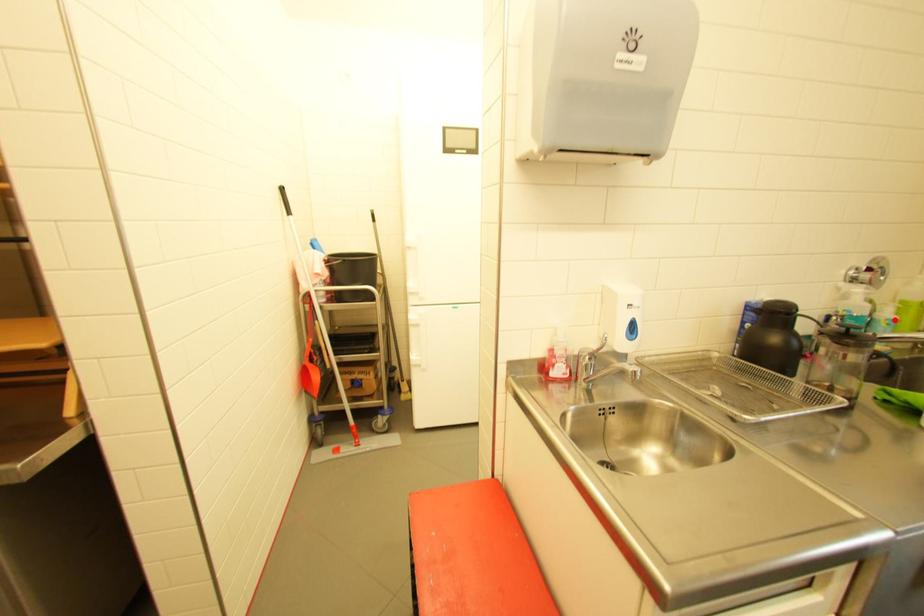
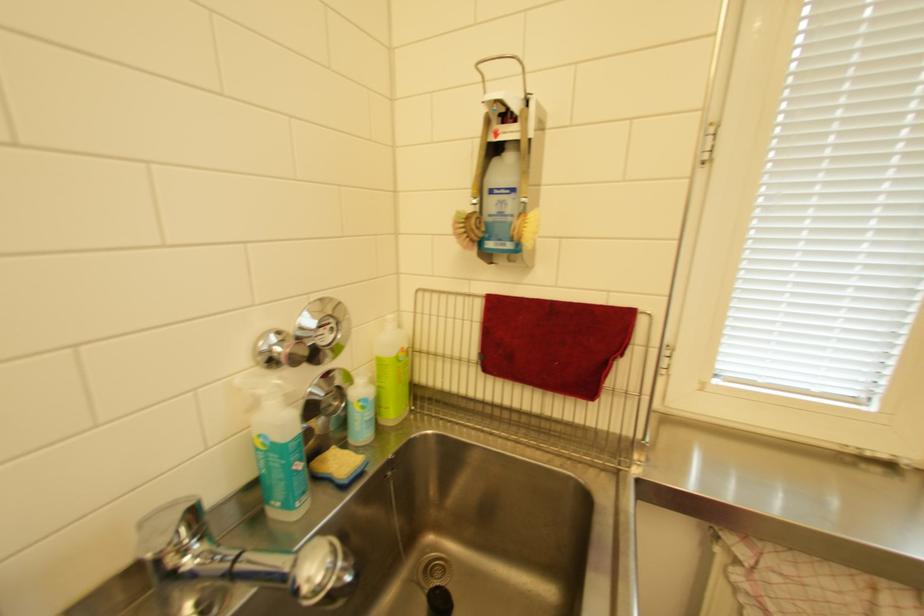
The point at the highlighted location is marked in the first image. Where is the corresponding point in the second image?

(367, 400)